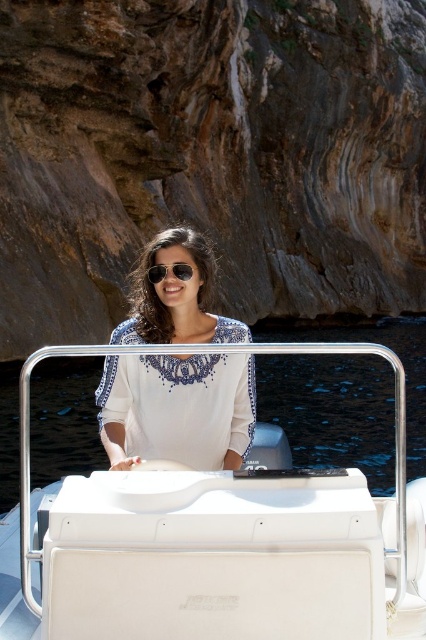
Does matte brown rock at center have a lesser width compared to matte black sunglasses at center?

Incorrect, matte brown rock at center's width is not less than matte black sunglasses at center's.

Measure the distance between point (288,19) and camera.

Point (288,19) and camera are 420.25 feet apart from each other.

Where is `matte brown rock at center`? Image resolution: width=426 pixels, height=640 pixels. matte brown rock at center is located at coordinates (210, 156).

Locate an element on the screen. The image size is (426, 640). matte brown rock at center is located at coordinates (210, 156).

Does white matte boat at center come behind matte black sunglasses at center?

No, it is not.

Does point (48, 593) come in front of point (161, 276)?

That is True.

Locate an element on the screen. This screenshot has height=640, width=426. white matte boat at center is located at coordinates (175, 566).

Is white matte boat at center to the left of white embroidered blouse at center from the viewer's perspective?

Incorrect, white matte boat at center is not on the left side of white embroidered blouse at center.

Between point (146, 547) and point (158, 381), which one is positioned behind?

The point (158, 381) is behind.

Locate an element on the screen. white matte boat at center is located at coordinates (175, 566).